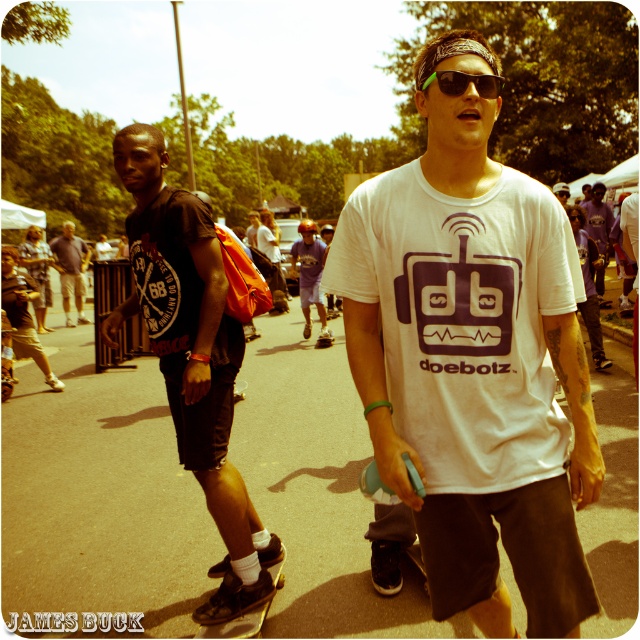
Question: Is black matte t-shirt at left closer to camera compared to purple cotton shirt at upper right?

Choices:
 (A) yes
 (B) no

Answer: (A)

Question: Is dark brown leather jacket at left to the right of purple cotton shirt at upper right from the viewer's perspective?

Choices:
 (A) no
 (B) yes

Answer: (A)

Question: Does black matte t-shirt at left have a greater width compared to purple cotton shirt at upper right?

Choices:
 (A) no
 (B) yes

Answer: (B)

Question: Among these points, which one is nearest to the camera?

Choices:
 (A) (81, 300)
 (B) (532, 301)

Answer: (B)

Question: Which point is farther to the camera?

Choices:
 (A) (81, 241)
 (B) (472, 81)
 (C) (508, 193)

Answer: (A)

Question: Which point is farther from the camera taking this photo?

Choices:
 (A) (483, 465)
 (B) (305, 305)
 (C) (604, 186)
 (D) (248, 616)

Answer: (C)